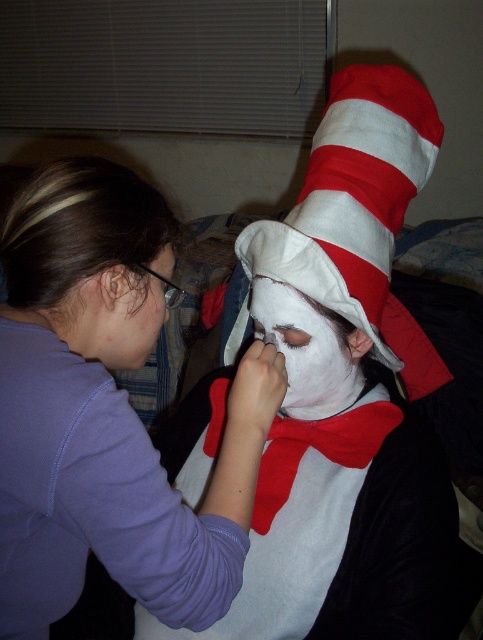
You are a makeup artist observing the scene. The white matte face paint at center is crucial for completing the Cat in the Hat costume. Based on its position, can you determine if it is within easy reach of the person on the right?

The white matte face paint at center is located at point (338,497), which is likely within easy reach of the person on the right as it is positioned centrally in the scene.

You are a costume designer observing the two people in the image. You need to determine which item is higher in position between the white matte face paint at center and the white fabric hat at center. Based on the scene, which one is taller?

The white matte face paint at center is taller than the white fabric hat at center according to the description.

You are a costume designer observing the two people in the image. You need to determine the spatial relationship between the purple fabric at upper left and the white matte face paint at center. Which object is covering the other?

The purple fabric at upper left is positioned over the white matte face paint at center, so it is covering it.